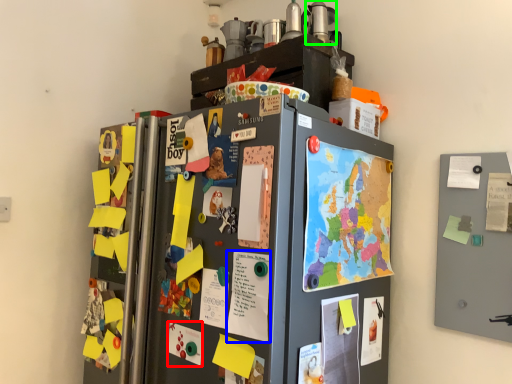
Question: Estimate the real-world distances between objects in this image. Which object is farther from poster (highlighted by a red box), poster (highlighted by a blue box) or appliance (highlighted by a green box)?

Choices:
 (A) poster
 (B) appliance

Answer: (B)